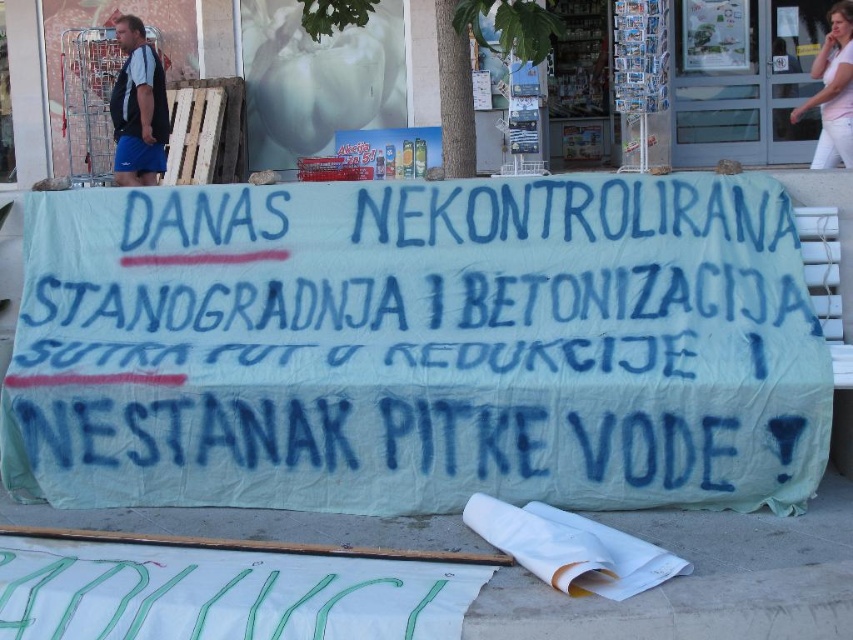
Question: Which object is the closest to the white fabric banner at center?

Choices:
 (A) white cotton shirt at upper right
 (B) white paper at lower center
 (C) blue fabric shorts at left

Answer: (B)

Question: Estimate the real-world distances between objects in this image. Which object is farther from the white fabric banner at center?

Choices:
 (A) white paper at lower center
 (B) blue fabric shorts at left

Answer: (B)

Question: Based on their relative distances, which object is nearer to the white fabric banner at center?

Choices:
 (A) white paper at lower center
 (B) white cotton shirt at upper right
 (C) blue fabric shorts at left

Answer: (A)

Question: Is blue fabric shorts at left below white cotton shirt at upper right?

Choices:
 (A) yes
 (B) no

Answer: (A)

Question: Is white paper at lower center behind white cotton shirt at upper right?

Choices:
 (A) no
 (B) yes

Answer: (A)

Question: Is white paper at lower center smaller than blue fabric shorts at left?

Choices:
 (A) yes
 (B) no

Answer: (B)